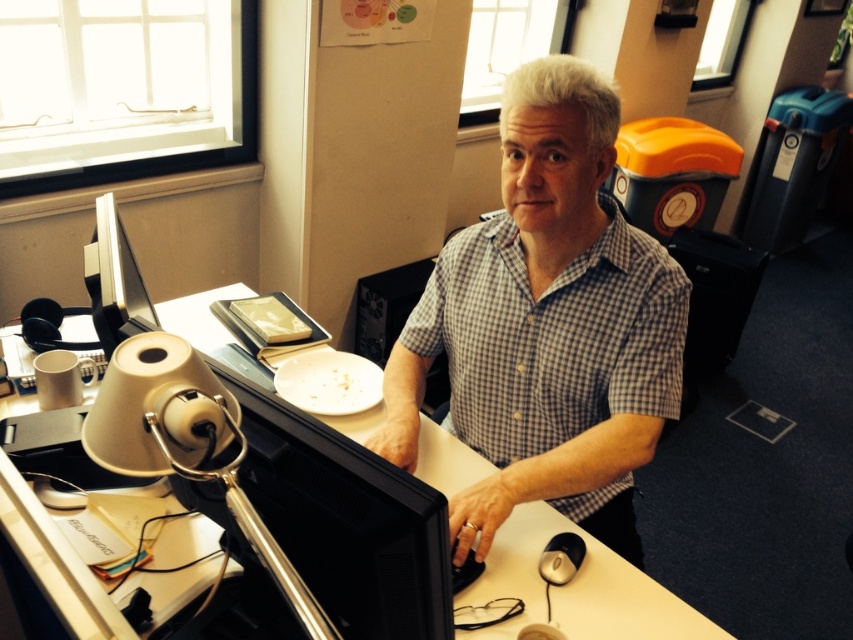
Consider the image. You are organizing the desk items. The satin black monitor at left and the black plastic mouse at lower center are both on the desk. Which object takes up more space on the desk?

The satin black monitor at left is larger in size than the black plastic mouse at lower center, so it takes up more space on the desk.

You are a delivery person who needs to place a small package on the desk without disturbing the man. The package requires 2 feet of space. Is there enough space between the checkered fabric shirt at center and the nearest edge of the desk to place it?

The distance between the checkered fabric shirt at center and the nearest edge of the desk is 3.44 feet, which is more than the required 2 feet. Therefore, there is sufficient space to place the package without disturbing the man.

You are an interior designer observing the office scene. You need to determine which object occupies more space in the image between the checkered fabric shirt at center and the white plastic table at center. Which one is it?

The checkered fabric shirt at center is larger in size than the white plastic table at center, so the checkered fabric shirt at center occupies more space in the image.